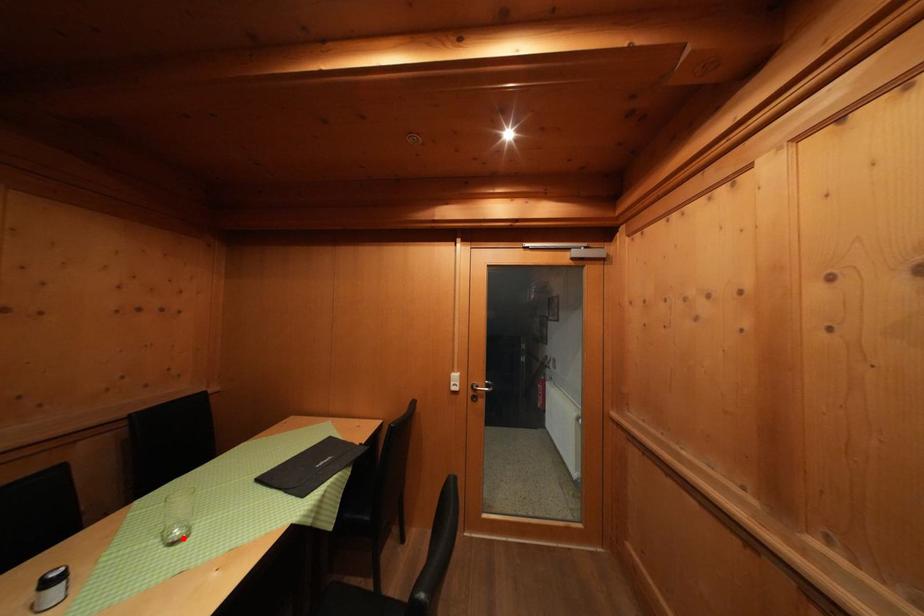
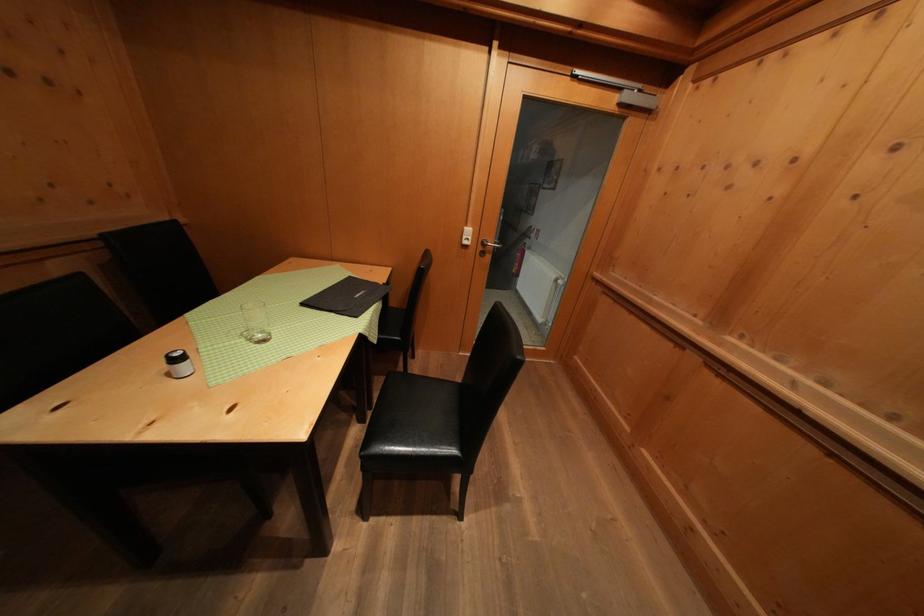
In the second image, find the point that corresponds to the highlighted location in the first image.

(264, 341)